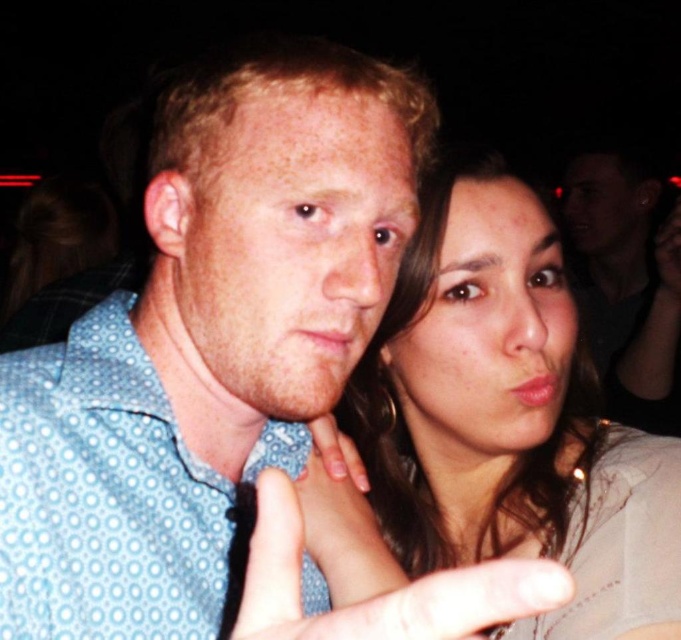
Question: Which object is farther from the camera taking this photo?

Choices:
 (A) matte gray shirt at center
 (B) white matte finger at center

Answer: (A)

Question: Which of these objects is positioned closest to the matte black shirt at upper right?

Choices:
 (A) white matte finger at center
 (B) matte gray shirt at center

Answer: (B)

Question: Does matte gray shirt at center have a lesser width compared to white matte finger at center?

Choices:
 (A) no
 (B) yes

Answer: (A)

Question: Which point is farther to the camera?

Choices:
 (A) white matte finger at center
 (B) matte gray shirt at center

Answer: (B)

Question: Is matte gray shirt at center bigger than white matte finger at center?

Choices:
 (A) yes
 (B) no

Answer: (A)

Question: Can you confirm if matte black shirt at upper right is bigger than white matte finger at center?

Choices:
 (A) no
 (B) yes

Answer: (B)